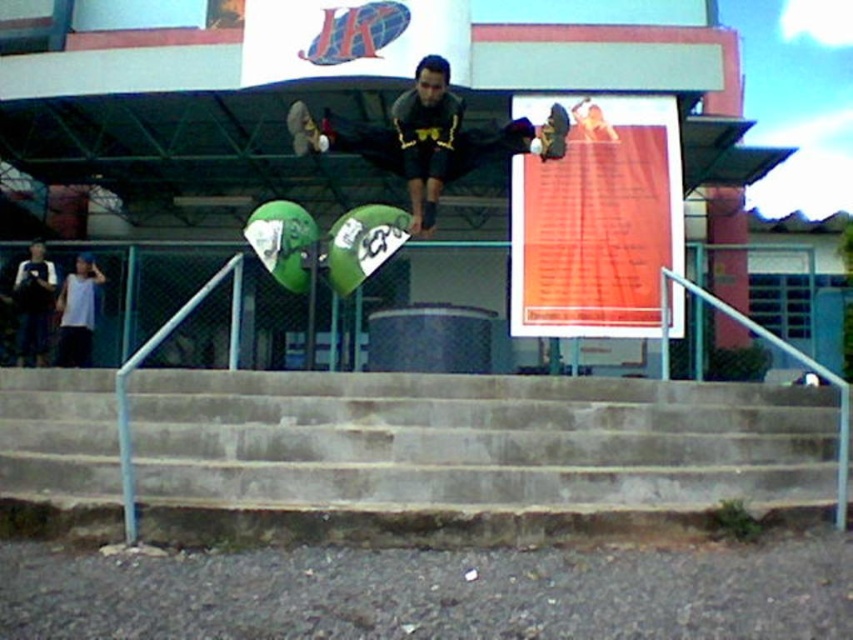
The image size is (853, 640). What do you see at coordinates (476, 440) in the screenshot?
I see `concrete stairs at center` at bounding box center [476, 440].

Between point (851, 419) and point (553, 120), which one is positioned behind?

The point (553, 120) is more distant.

Describe the element at coordinates (476, 440) in the screenshot. I see `concrete stairs at center` at that location.

This screenshot has width=853, height=640. What are the coordinates of `concrete stairs at center` in the screenshot? It's located at (476, 440).

Which of these two, matte black skateboard at center or green matte skateboard at center, stands shorter?

With less height is green matte skateboard at center.

Is matte black skateboard at center shorter than green matte skateboard at center?

In fact, matte black skateboard at center may be taller than green matte skateboard at center.

Which is in front, point (503, 148) or point (563, 116)?

Point (563, 116) is in front.

Where is `matte black skateboard at center`? The width and height of the screenshot is (853, 640). matte black skateboard at center is located at coordinates (415, 138).

Is concrete stairs at center in front of matte black skateboard at center?

That is True.

Is concrete stairs at center above matte black skateboard at center?

Incorrect, concrete stairs at center is not positioned above matte black skateboard at center.

Is point (312, 442) behind point (402, 113)?

No, it is not.

The image size is (853, 640). What are the coordinates of `concrete stairs at center` in the screenshot? It's located at (476, 440).